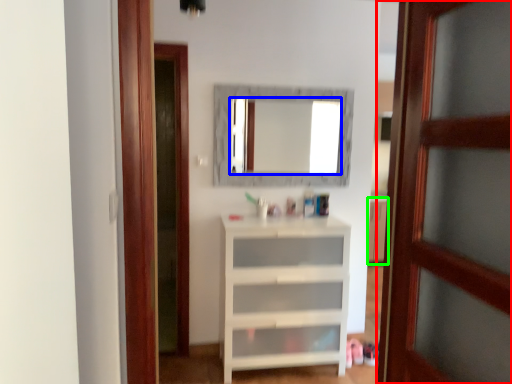
Question: Based on their relative distances, which object is nearer to door (highlighted by a red box)? Choose from mirror (highlighted by a blue box) and cabinetry (highlighted by a green box).

Choices:
 (A) mirror
 (B) cabinetry

Answer: (B)